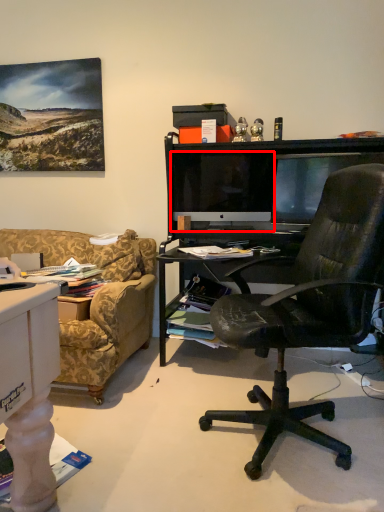
Question: From the image's perspective, what is the correct spatial relationship of computer monitor (annotated by the red box) in relation to television?

Choices:
 (A) below
 (B) above

Answer: (B)